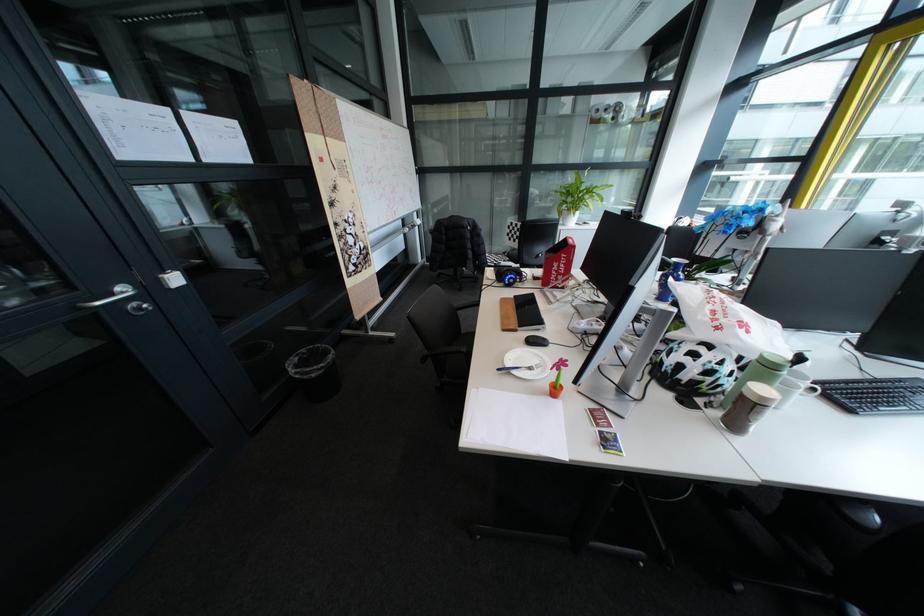
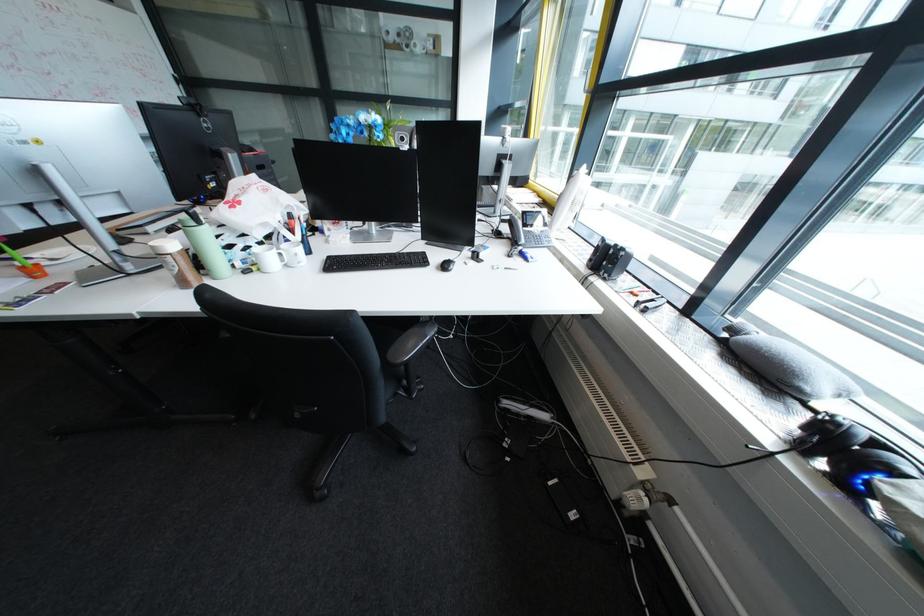
Question: I am providing you with two images of the same scene from different viewpoints. After the viewpoint changes to image2, which objects are now occluded?

Choices:
 (A) bicycle helmet
 (B) black computer mouse
 (C) light green bottle
 (D) white notepad

Answer: (A)